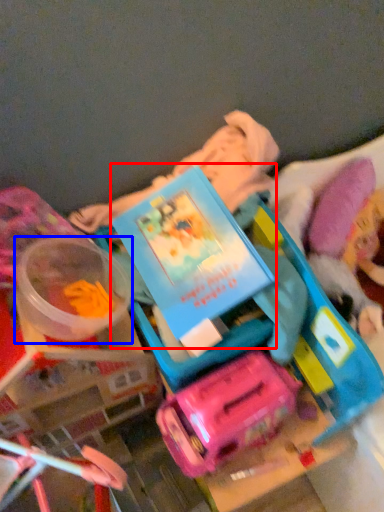
Question: Which of the following is the closest to the observer, book (highlighted by a red box) or toy (highlighted by a blue box)?

Choices:
 (A) book
 (B) toy

Answer: (A)